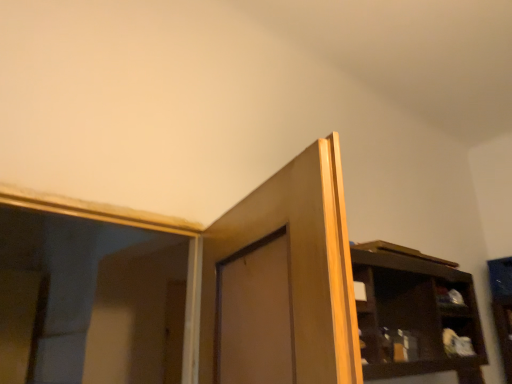
This screenshot has height=384, width=512. What do you see at coordinates (450, 297) in the screenshot? I see `matte black shelf at lower right` at bounding box center [450, 297].

Identify the location of matte black shelf at lower right. This screenshot has height=384, width=512. (450, 297).

Find the location of a particular element. This screenshot has width=512, height=384. matte black shelf at lower right is located at coordinates (450, 297).